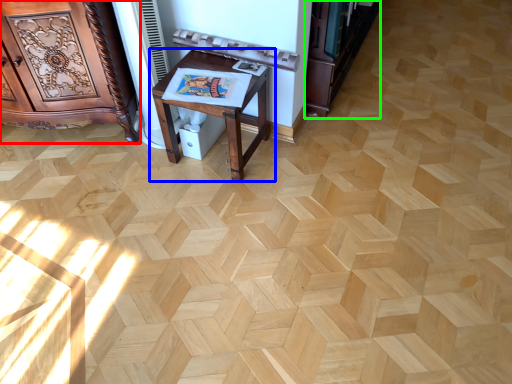
Question: Which object is positioned closest to furniture (highlighted by a red box)? Select from table (highlighted by a blue box) and bookshelf (highlighted by a green box).

Choices:
 (A) table
 (B) bookshelf

Answer: (A)